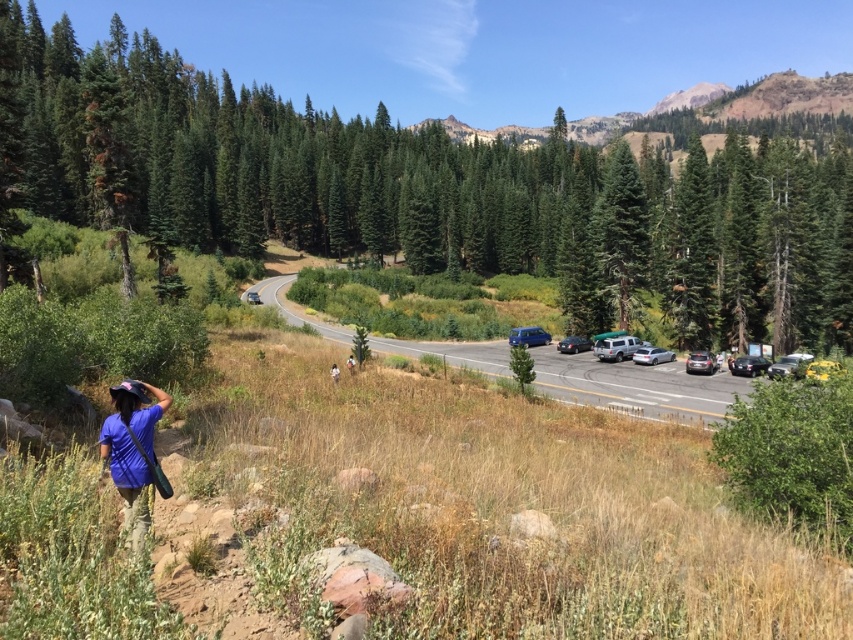
Is metallic asphalt highway at center shorter than metallic blue car at center?

No, metallic asphalt highway at center is not shorter than metallic blue car at center.

Is metallic asphalt highway at center wider than metallic blue car at center?

Yes, metallic asphalt highway at center is wider than metallic blue car at center.

Between point (283, 314) and point (537, 337), which one is positioned behind?

The point (283, 314) is behind.

You are a GUI agent. You are given a task and a screenshot of the screen. Output one action in this format:
    pyautogui.click(x=<x>, y=<y>)
    Task: Click on the metallic asphalt highway at center
    This screenshot has width=853, height=640.
    Given the screenshot: What is the action you would take?
    pyautogui.click(x=637, y=387)

Does point (721, 252) come farther from viewer compared to point (579, 348)?

Yes, point (721, 252) is farther from viewer.

What do you see at coordinates (451, 186) in the screenshot? I see `green leafy tree at center` at bounding box center [451, 186].

Is point (79, 67) more distant than point (578, 337)?

Yes, it is behind point (578, 337).

Locate an element on the screen. The height and width of the screenshot is (640, 853). green leafy tree at center is located at coordinates (451, 186).

Who is shorter, metallic silver car at center-right or brown fabric person at lower center?

With less height is brown fabric person at lower center.

Does metallic silver car at center-right appear over brown fabric person at lower center?

Actually, metallic silver car at center-right is below brown fabric person at lower center.

Is point (697, 355) closer to viewer compared to point (354, 360)?

No, (697, 355) is further to viewer.

The image size is (853, 640). Identify the location of metallic silver car at center-right. (700, 362).